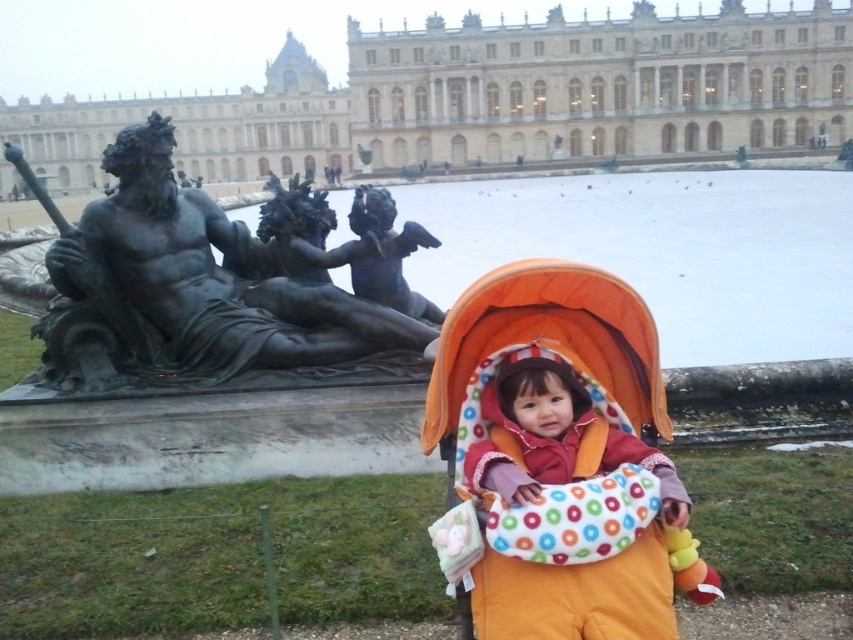
Between orange fabric baby carriage at center and bronze cherub at center, which one has less height?

bronze cherub at center is shorter.

Is point (554, 289) farther from viewer compared to point (409, 227)?

No, it is in front of (409, 227).

What do you see at coordinates (549, 337) in the screenshot? I see `orange fabric baby carriage at center` at bounding box center [549, 337].

This screenshot has height=640, width=853. Identify the location of orange fabric baby carriage at center. (549, 337).

Who is shorter, stone marble palace at center or bronze cherub at center?

bronze cherub at center

Between point (614, 19) and point (358, 195), which one is positioned behind?

Positioned behind is point (614, 19).

Does point (802, 83) lie in front of point (393, 276)?

No, it is behind (393, 276).

At what (x,y) coordinates should I click in order to perform the action: click on stone marble palace at center. Please return your answer as a coordinate pair (x, y). Looking at the image, I should click on (490, 97).

Who is positioned more to the left, bronze statue at left or bronze cherub at center?

From the viewer's perspective, bronze statue at left appears more on the left side.

Does bronze statue at left have a lesser width compared to bronze cherub at center?

Incorrect, bronze statue at left's width is not less than bronze cherub at center's.

Is point (405, 356) farther from camera compared to point (392, 257)?

No.

You are a GUI agent. You are given a task and a screenshot of the screen. Output one action in this format:
    pyautogui.click(x=<x>, y=<y>)
    Task: Click on the bronze statue at left
    
    Given the screenshot: What is the action you would take?
    pyautogui.click(x=200, y=288)